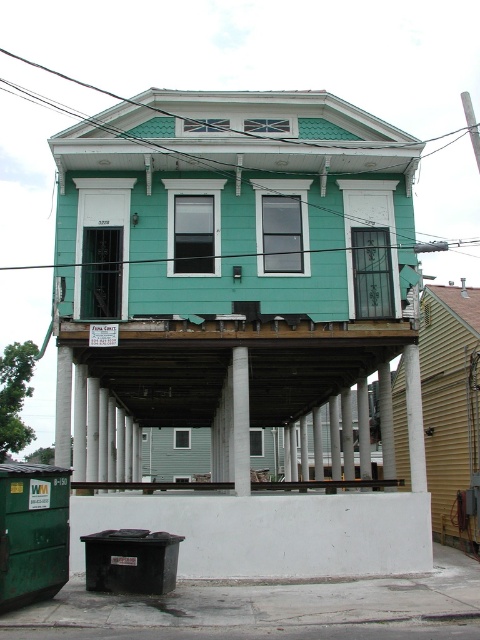
You are a delivery person trying to park your van near the house. The van needs to pass under the space between the green matte dumpster at lower left and the metallic silver rail at lower center. Can the van, which is 2 meters tall, safely pass under this area?

The green matte dumpster at lower left has a lesser height compared to the metallic silver rail at lower center. Since the dumpster is shorter, the lowest point under the house would be determined by the dumpster. If the dumpster is lower than 2 meters, the van might not fit. However, since the dumpster is shorter than the rail, the van could potentially pass under the area near the dumpster as long as the height there is sufficient. Without exact measurements, it is uncertain, but based on the given info,

You are a delivery person with a 15 feet long ladder that needs to be placed horizontally between the green matte dumpster at lower left and the metallic silver rail at lower center. Can the ladder fit between them?

The distance between the green matte dumpster at lower left and the metallic silver rail at lower center is 17.25 feet. Since the ladder is 15 feet long, it can fit between them as the distance is greater than the ladder length.